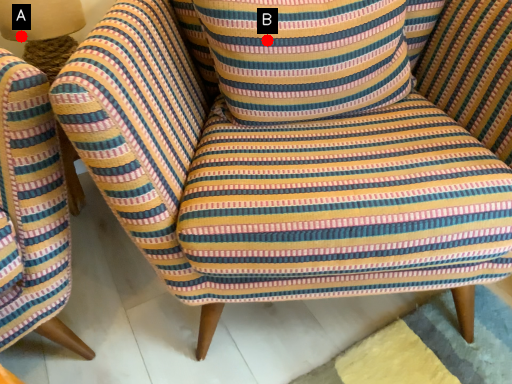
Question: Two points are circled on the image, labeled by A and B beside each circle. Which point is closer to the camera taking this photo?

Choices:
 (A) A is closer
 (B) B is closer

Answer: (B)